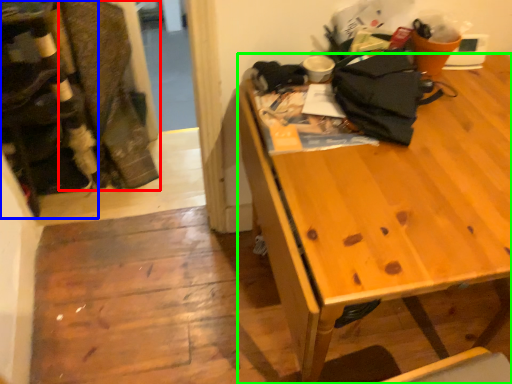
Question: Considering the real-world distances, which object is farthest from laundry (highlighted by a red box)? leftover (highlighted by a blue box) or desk (highlighted by a green box)?

Choices:
 (A) leftover
 (B) desk

Answer: (B)